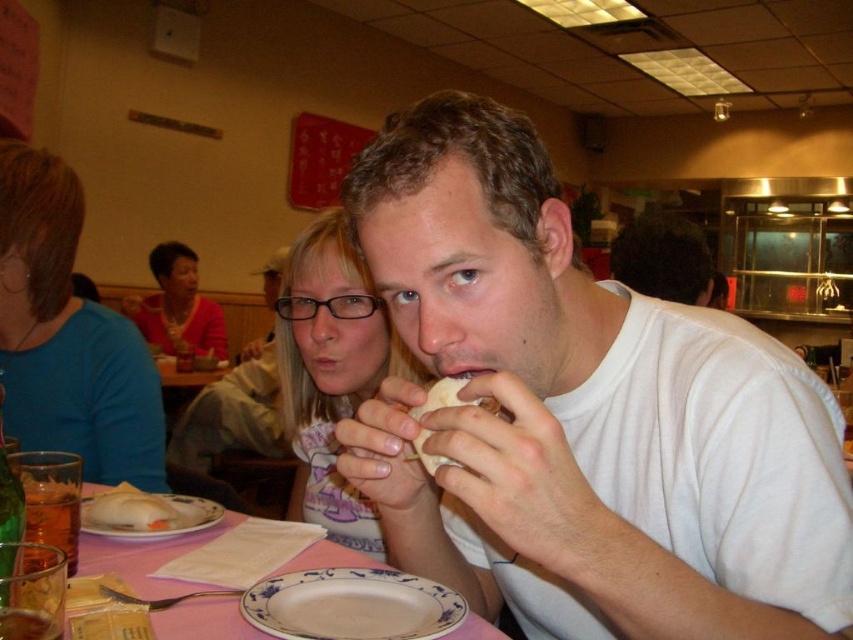
You are a photographer standing in front of the table with the pink tablecloth. You want to take a photo of the dark brown hair at center without any obstructions. The camera you are using has a minimum focusing distance of 2 meters. Can you take the photo from your current position?

The distance between dark brown hair at center and the camera is 2.67 meters, which is greater than the camera minimum focusing distance of 2 meters. Therefore, you can take the photo from your current position.

You are a photographer trying to capture a closeup of the items on the table. You notice two points of interest marked as point (679, 257) and point (190, 499). Which point should you focus on to ensure the closest item to the camera is in sharp focus?

Point (679, 257) is further to the camera than point (190, 499), so you should focus on point (679, 257) to capture the closest item in sharp focus.

You are a photographer adjusting your camera settings to focus on two points in the scene. The first point is at coordinates point (120, 342) and the second is at point (656, 272). Which point should you focus on first to ensure the closest object is in sharp focus?

Point (120, 342) is closer to the camera than point (656, 272), so you should focus on point (120, 342) first to ensure the closest object is in sharp focus.